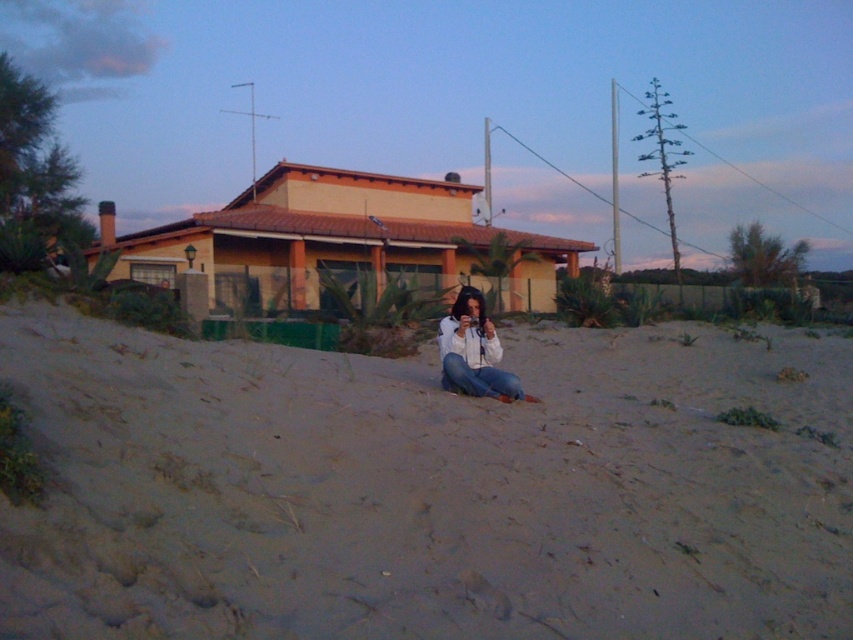
You are standing on the beach and want to place a 1.5 meter wide surfboard between the smooth sand at center and the white matte shirt at center. Can the surfboard fit between them?

The smooth sand at center is wider than the white matte shirt at center, but the exact width difference isn not provided. Without knowing the actual widths, it is impossible to determine if the 1.5 meter surfboard can fit between them.

You are standing at the edge of the beach and want to place a small flag exactly at the center of the smooth sand at center. According to the coordinates provided, where should you place the flag?

The flag should be placed at the coordinates point (x=426, y=490) where the smooth sand at center is located.